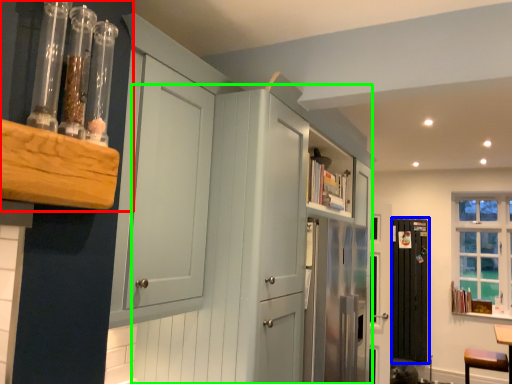
Question: Which is nearer to the shelf (highlighted by a red box)? screen door (highlighted by a blue box) or dresser (highlighted by a green box).

Choices:
 (A) screen door
 (B) dresser

Answer: (B)